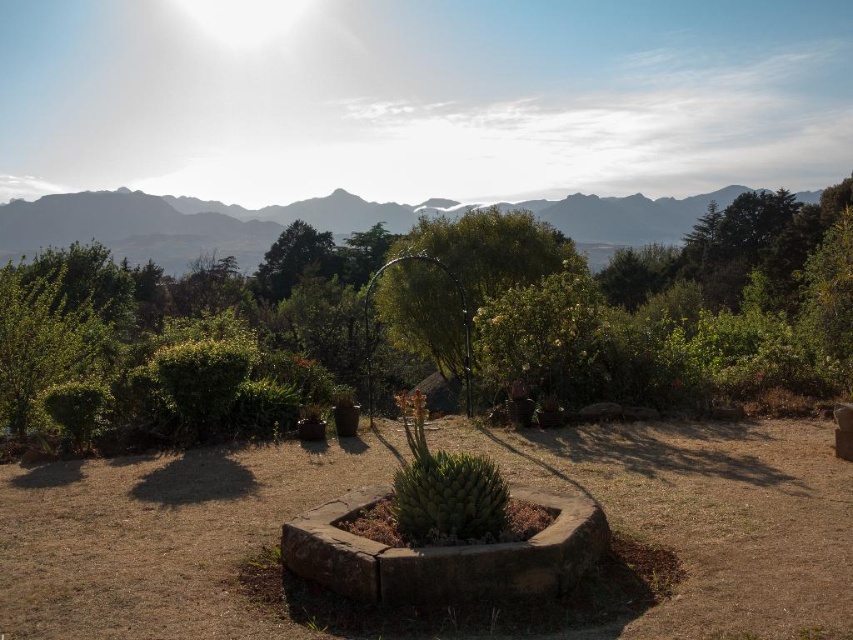
Which is in front, point (393, 280) or point (460, 509)?

Point (460, 509) is in front.

Locate an element on the screen. Image resolution: width=853 pixels, height=640 pixels. green leafy tree at center is located at coordinates (462, 276).

Where is `green leafy tree at center`? Image resolution: width=853 pixels, height=640 pixels. green leafy tree at center is located at coordinates (462, 276).

Based on the photo, who is higher up, green leafy tree at center or green leafy tree at upper center?

green leafy tree at upper center is above.

This screenshot has height=640, width=853. Identify the location of green leafy tree at center. (462, 276).

The width and height of the screenshot is (853, 640). What are the coordinates of `green leafy tree at center` in the screenshot? It's located at (462, 276).

Who is taller, green textured mountain at upper center or green succulent at center?

green textured mountain at upper center is taller.

From the picture: Measure the distance between green textured mountain at upper center and camera.

225.67 feet

Does point (9, 253) come in front of point (471, 456)?

No, it is behind (471, 456).

This screenshot has width=853, height=640. In order to click on green textured mountain at upper center in this screenshot , I will do `click(189, 224)`.